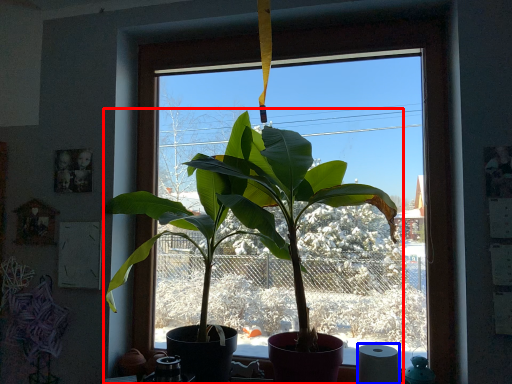
Question: Which point is further to the camera, houseplant (highlighted by a red box) or toilet paper (highlighted by a blue box)?

Choices:
 (A) houseplant
 (B) toilet paper

Answer: (B)